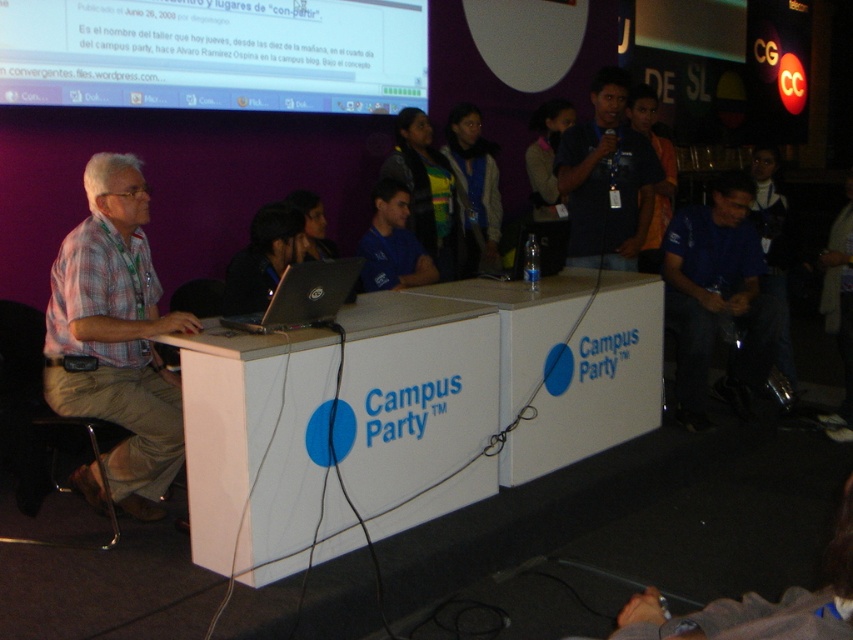
Question: Which point appears closest to the camera in this image?

Choices:
 (A) (262, 339)
 (B) (759, 384)

Answer: (A)

Question: Which of the following is the closest to the observer?

Choices:
 (A) yellow-green fabric jacket at center
 (B) silver metallic laptop at center

Answer: (B)

Question: Which of these objects is positioned farthest from the blue fabric shirt at lower right?

Choices:
 (A) white glossy projector screen at upper center
 (B) white glossy table at center
 (C) plaid shirt at left
 (D) white cardboard table at center

Answer: (C)

Question: Is white glossy table at center below white cardboard table at center?

Choices:
 (A) no
 (B) yes

Answer: (B)

Question: In this image, where is plaid shirt at left located relative to black shirt at center?

Choices:
 (A) below
 (B) above

Answer: (A)

Question: Can you confirm if white glossy table at center is thinner than blue fabric shirt at lower right?

Choices:
 (A) yes
 (B) no

Answer: (B)